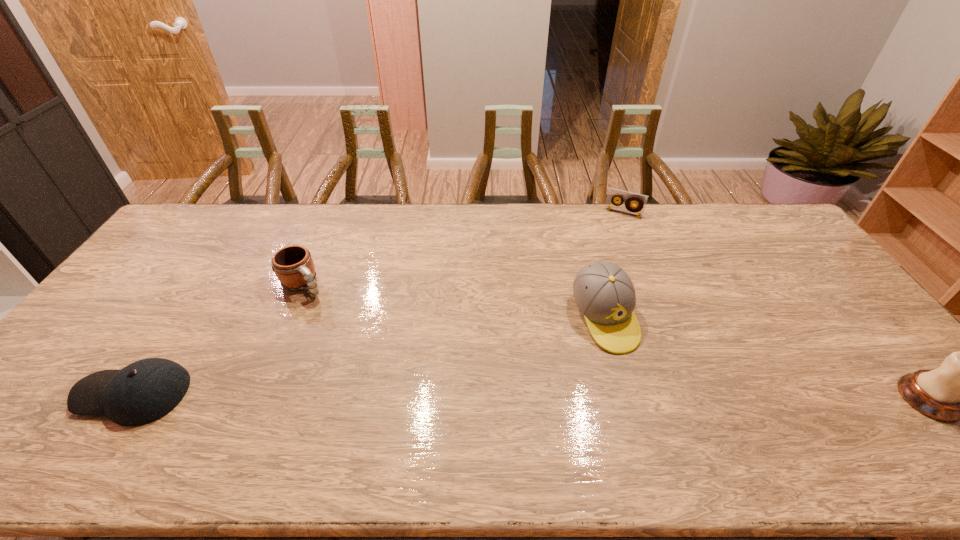
This screenshot has width=960, height=540. I want to click on vacant space on the desktop that is between the nearer baseball cap and the candle holder and is positioned at the front of the second object from right to left with visible reels, so click(555, 396).

You are a GUI agent. You are given a task and a screenshot of the screen. Output one action in this format:
    pyautogui.click(x=<x>, y=<y>)
    Task: Click on the free space on the desktop that is between the left baseball cap and the candle holder and is positioned on the side of the mug with the handle
    This screenshot has width=960, height=540.
    Given the screenshot: What is the action you would take?
    pyautogui.click(x=410, y=395)

Locate an element on the screen. Image resolution: width=960 pixels, height=540 pixels. vacant space on the desktop that is between the shorter baseball cap and the rightmost object and is positioned on the front-facing side of the right baseball cap is located at coordinates (649, 397).